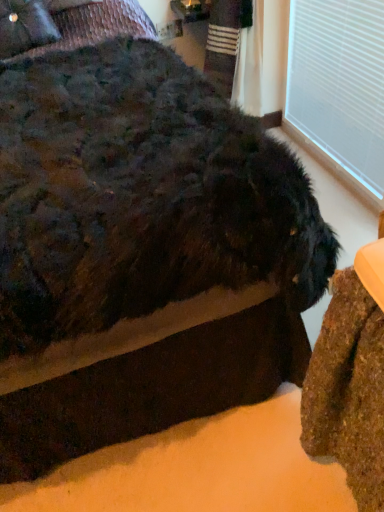
Question: Relative to white plastic window frame at upper right, is velvet-like dark brown pillow at upper left in front or behind?

Choices:
 (A) behind
 (B) front

Answer: (A)

Question: Is velvet-like dark brown pillow at upper left inside or outside of white plastic window frame at upper right?

Choices:
 (A) inside
 (B) outside

Answer: (B)

Question: Estimate the real-world distances between objects in this image. Which object is farther from the white plastic window frame at upper right?

Choices:
 (A) velvet-like dark brown pillow at upper left
 (B) fuzzy black dog at center

Answer: (A)

Question: Based on their relative distances, which object is farther from the white plastic window frame at upper right?

Choices:
 (A) velvet-like dark brown pillow at upper left
 (B) fuzzy black dog at center

Answer: (A)